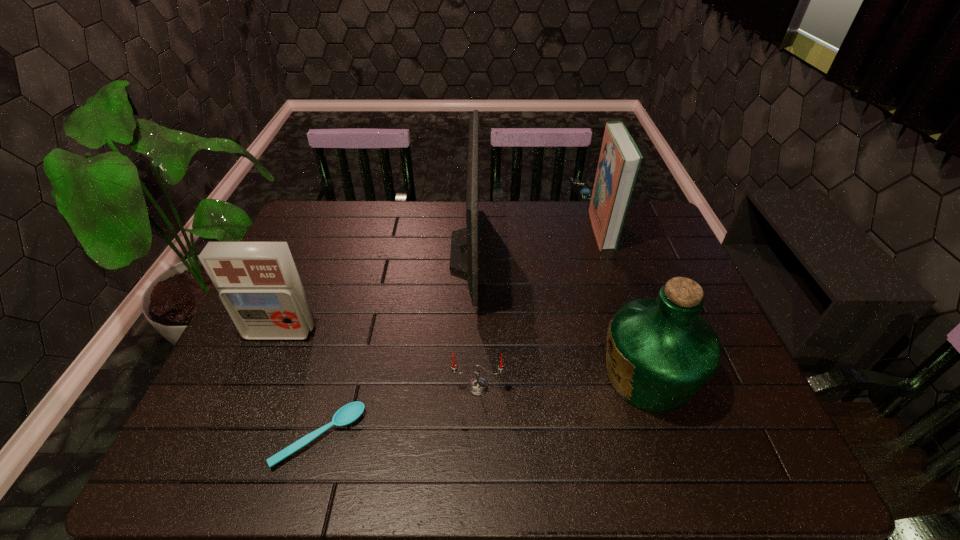
The image size is (960, 540). What are the coordinates of `object present at the left edge` in the screenshot? It's located at (258, 283).

I want to click on object located in the right edge section of the desktop, so click(660, 351).

Locate an element on the screen. This screenshot has width=960, height=540. vacant space at the far edge of the desktop is located at coordinates point(381,212).

Identify the location of blank space at the near edge of the desktop. This screenshot has width=960, height=540. (588, 441).

In the image, there is a desktop. Where is `vacant space at the left edge`? vacant space at the left edge is located at coordinates (222, 389).

You are a GUI agent. You are given a task and a screenshot of the screen. Output one action in this format:
    pyautogui.click(x=<x>, y=<y>)
    Task: Click on the vacant space at the right edge
    The image size is (960, 540).
    Given the screenshot: What is the action you would take?
    pyautogui.click(x=721, y=382)

At what (x,y) coordinates should I click in order to perform the action: click on blank space at the far left corner of the desktop. Please return your answer as a coordinate pair (x, y). Looking at the image, I should click on (294, 233).

Where is `free space at the near left corner of the desktop`? free space at the near left corner of the desktop is located at coordinates (182, 463).

Locate an element on the screen. Image resolution: width=960 pixels, height=540 pixels. vacant area at the far right corner of the desktop is located at coordinates (659, 225).

This screenshot has height=540, width=960. In order to click on free space between the liquor and the candle in this screenshot , I will do `click(563, 381)`.